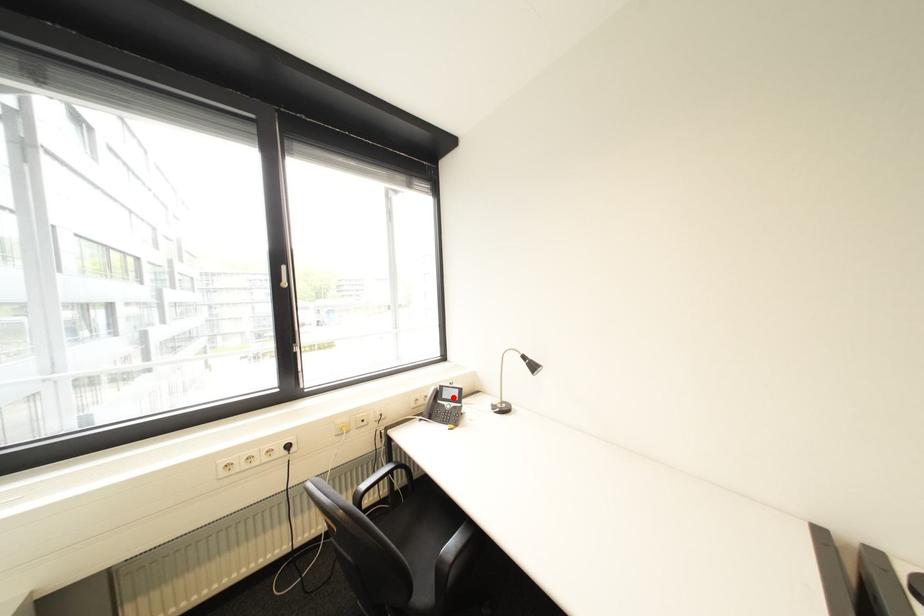
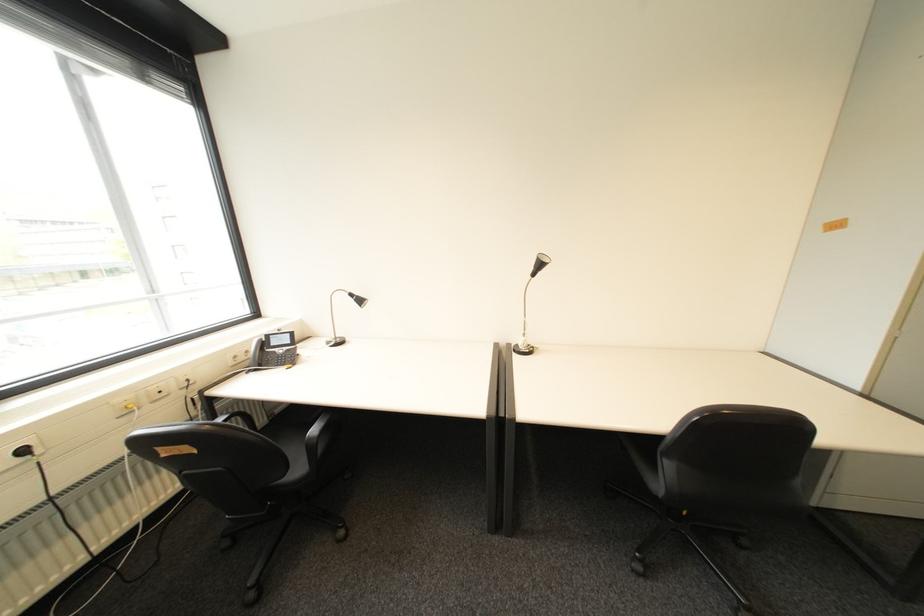
Question: I am providing you with two images of the same scene from different viewpoints. A red point is shown in image1. For the corresponding object point in image2, is it positioned nearer or farther from the camera?

Choices:
 (A) Nearer
 (B) Farther

Answer: (A)